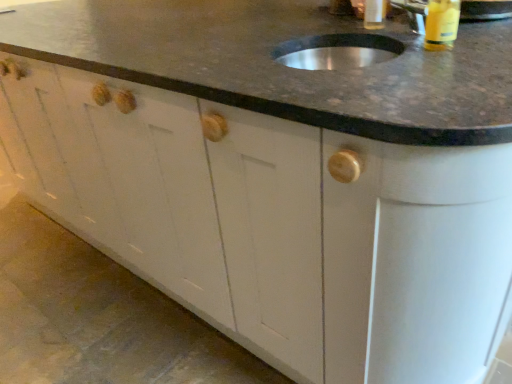
At what (x,y) coordinates should I click in order to perform the action: click on free space to the back side of translucent plastic bottle at upper center, which appears as the 2th beverage when viewed from the front. Please return your answer as a coordinate pair (x, y). Looking at the image, I should click on (345, 15).